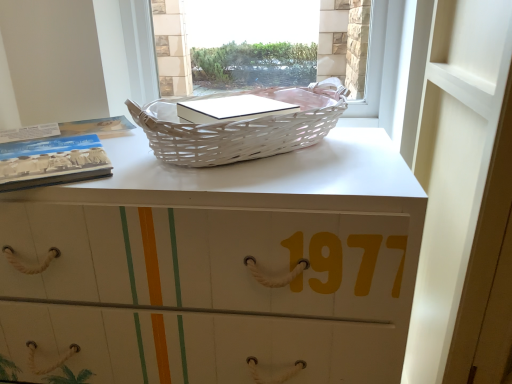
Question: Is white matte desk at center facing away from white wicker basket at upper center?

Choices:
 (A) no
 (B) yes

Answer: (A)

Question: Is white matte desk at center behind white wicker basket at upper center?

Choices:
 (A) no
 (B) yes

Answer: (A)

Question: Is white matte desk at center wider than white wicker basket at upper center?

Choices:
 (A) yes
 (B) no

Answer: (A)

Question: Can we say white matte desk at center lies outside white wicker basket at upper center?

Choices:
 (A) yes
 (B) no

Answer: (A)

Question: Is white matte desk at center positioned far away from white wicker basket at upper center?

Choices:
 (A) yes
 (B) no

Answer: (B)

Question: Considering their positions, is matte paper book at left located in front of or behind white matte desk at center?

Choices:
 (A) front
 (B) behind

Answer: (B)

Question: From the image's perspective, is matte paper book at left located above or below white matte desk at center?

Choices:
 (A) below
 (B) above

Answer: (B)

Question: Visually, is matte paper book at left positioned to the left or to the right of white matte desk at center?

Choices:
 (A) right
 (B) left

Answer: (B)

Question: Does point (87, 145) appear closer or farther from the camera than point (105, 292)?

Choices:
 (A) farther
 (B) closer

Answer: (A)

Question: From the image's perspective, is white matte desk at center positioned above or below white wicker basket at upper center?

Choices:
 (A) above
 (B) below

Answer: (B)

Question: Would you say white matte desk at center is to the left or to the right of white wicker basket at upper center in the picture?

Choices:
 (A) right
 (B) left

Answer: (B)

Question: Is white matte desk at center wider or thinner than white wicker basket at upper center?

Choices:
 (A) thin
 (B) wide

Answer: (B)

Question: Is point (267, 253) positioned closer to the camera than point (169, 64)?

Choices:
 (A) closer
 (B) farther

Answer: (A)

Question: Would you say matte paper book at left is to the left or to the right of white wicker picnic basket at upper center in the picture?

Choices:
 (A) right
 (B) left

Answer: (B)

Question: Is point (62, 157) positioned closer to the camera than point (262, 91)?

Choices:
 (A) closer
 (B) farther

Answer: (A)